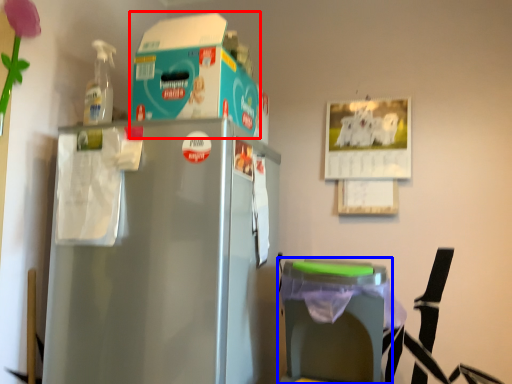
Question: Among these objects, which one is nearest to the camera, storage box (highlighted by a red box) or table (highlighted by a blue box)?

Choices:
 (A) storage box
 (B) table

Answer: (B)